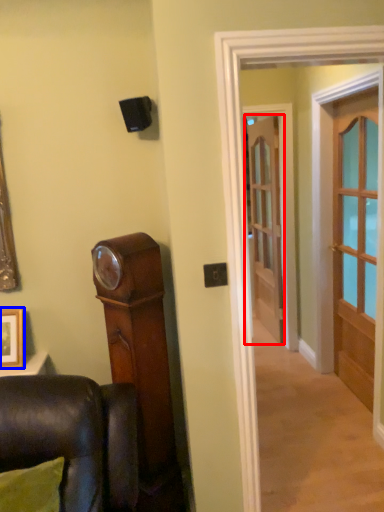
Question: Which of the following is the farthest to the observer, door (highlighted by a red box) or picture frame (highlighted by a blue box)?

Choices:
 (A) door
 (B) picture frame

Answer: (A)